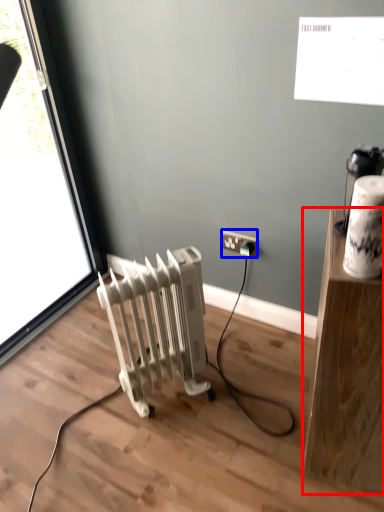
Question: Which object is further to the camera taking this photo, furniture (highlighted by a red box) or power plugs and sockets (highlighted by a blue box)?

Choices:
 (A) furniture
 (B) power plugs and sockets

Answer: (B)